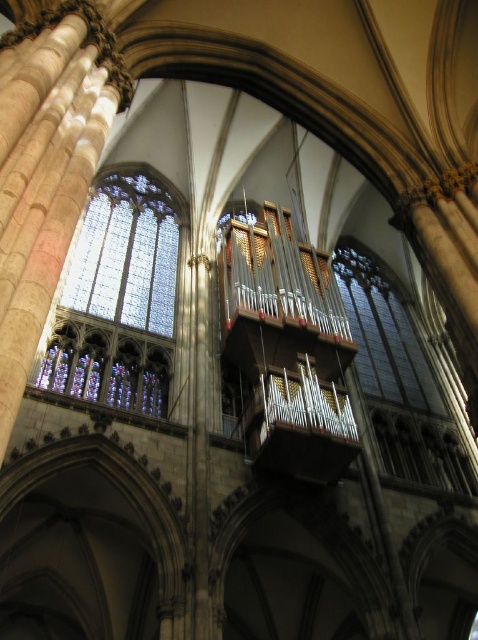
You are an architect visiting the cathedral and want to install a new lighting fixture between the metallic pipes at center and the stained glass at center. Based on their sizes, which object should the fixture be placed closer to?

The metallic pipes at center are larger than the stained glass at center, so the lighting fixture should be placed closer to the stained glass at center to maintain balance and avoid obstruction.

You are standing inside the grand cathedral and looking up. You notice two windows in front of you. The first is a stained glass at center, and the second is a clear glass window at center. Which one is positioned higher up in the cathedral?

The stained glass at center is located above the clear glass window at center, so it is positioned higher up in the cathedral.